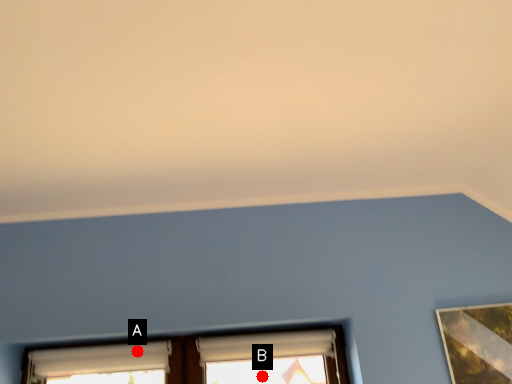
Question: Two points are circled on the image, labeled by A and B beside each circle. Among these points, which one is farthest from the camera?

Choices:
 (A) A is further
 (B) B is further

Answer: (B)